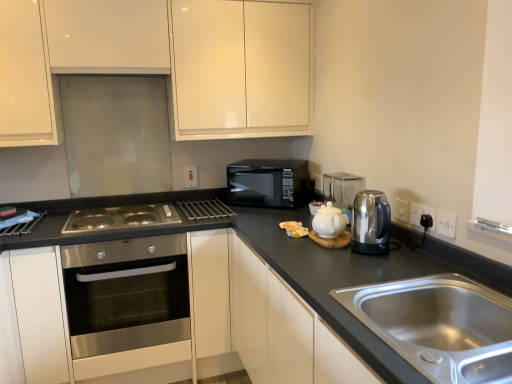
Identify the location of vacant space situated above metallic silver rack at center, which is the 3th appliance from right to left (from a real-world perspective). (202, 206).